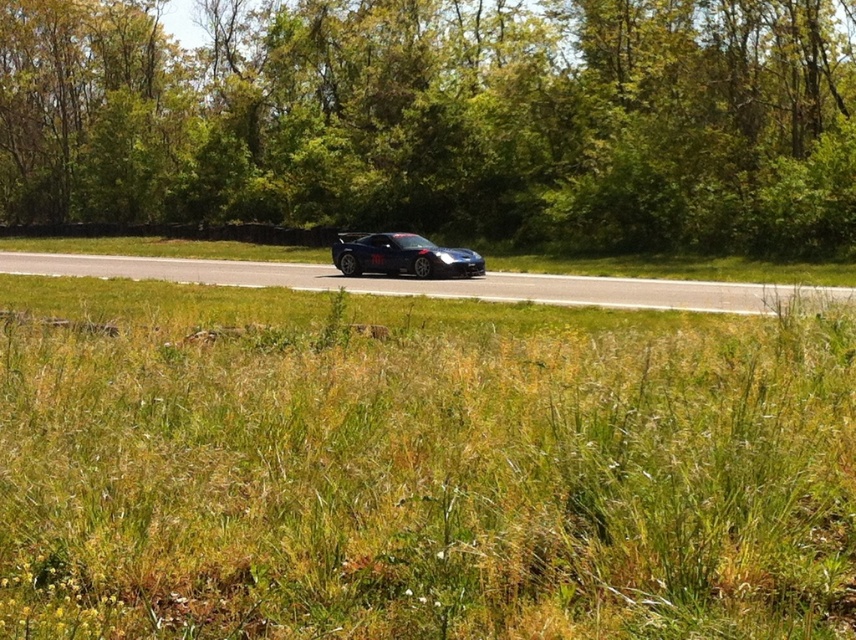
Is green leafy trees at center to the left of shiny blue car at center from the viewer's perspective?

Indeed, green leafy trees at center is positioned on the left side of shiny blue car at center.

Where is `green leafy trees at center`? green leafy trees at center is located at coordinates pyautogui.click(x=441, y=118).

I want to click on green leafy trees at center, so click(441, 118).

Is green leafy trees at center to the right of glossy black car at center from the viewer's perspective?

Incorrect, green leafy trees at center is not on the right side of glossy black car at center.

Describe the element at coordinates (441, 118) in the screenshot. I see `green leafy trees at center` at that location.

At what (x,y) coordinates should I click in order to perform the action: click on green leafy trees at center. Please return your answer as a coordinate pair (x, y). The width and height of the screenshot is (856, 640). Looking at the image, I should click on (441, 118).

Does green grass at center have a lesser height compared to shiny blue car at center?

Indeed, green grass at center has a lesser height compared to shiny blue car at center.

From the picture: Which is more to the left, green grass at center or shiny blue car at center?

shiny blue car at center is more to the left.

Between point (484, 525) and point (391, 264), which one is positioned behind?

Positioned behind is point (391, 264).

This screenshot has height=640, width=856. Find the location of `green grass at center`. green grass at center is located at coordinates (418, 468).